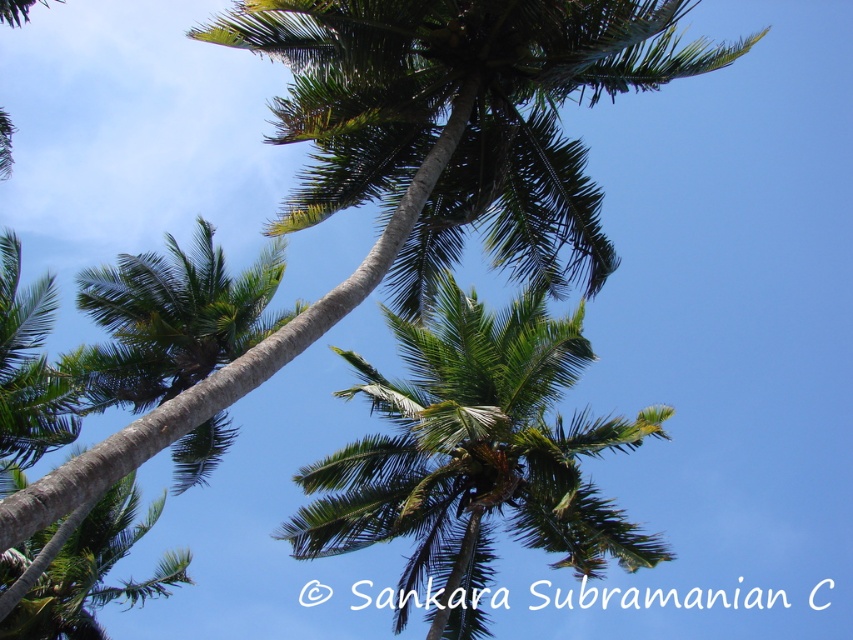
Does green leafy palm tree at center appear on the right side of green leafy palm tree at upper left?

Yes, green leafy palm tree at center is to the right of green leafy palm tree at upper left.

Which is more to the right, green leafy palm tree at center or green leafy palm tree at upper left?

Positioned to the right is green leafy palm tree at center.

Who is more forward, (395, 630) or (202, 268)?

Point (395, 630) is more forward.

Image resolution: width=853 pixels, height=640 pixels. I want to click on green leafy palm tree at center, so [x=474, y=456].